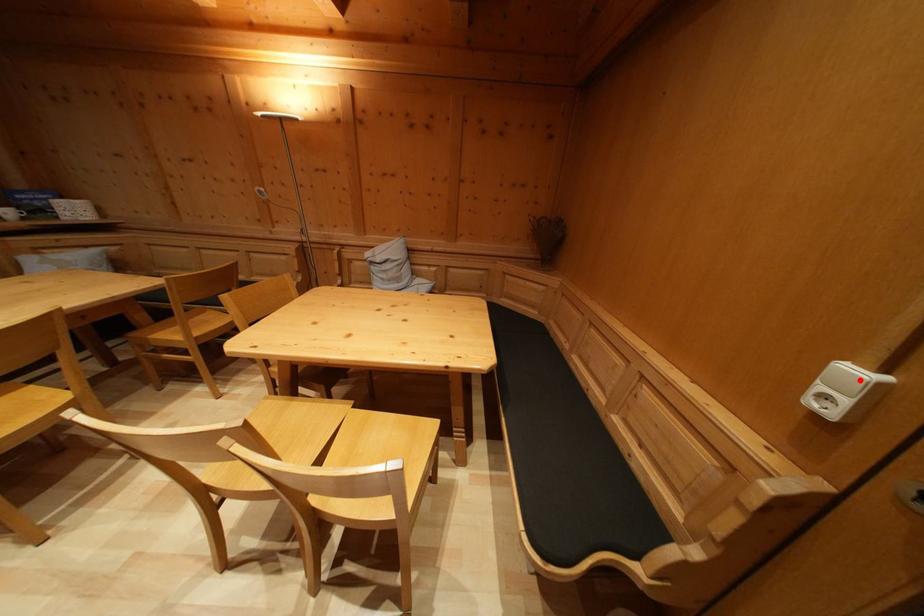
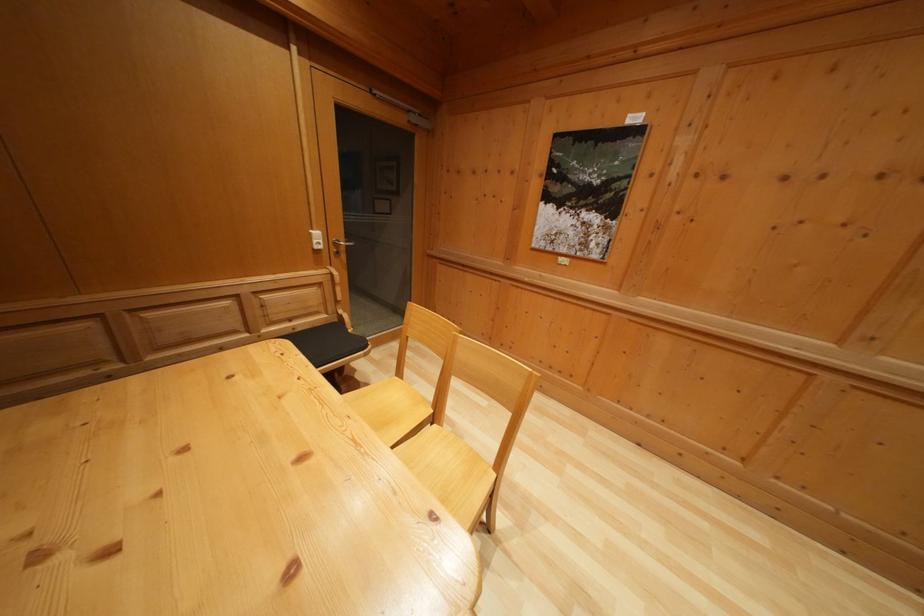
Find the pixel in the second image that matches the highlighted location in the first image.

(322, 240)